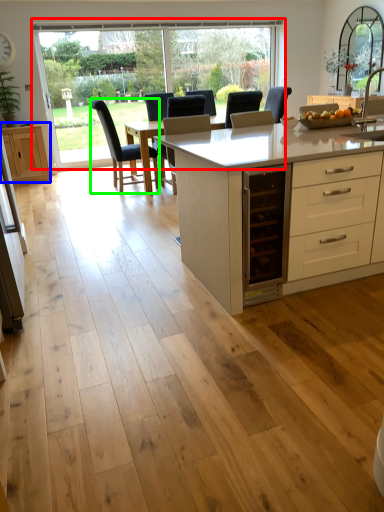
Question: Considering the real-world distances, which object is farthest from window (highlighted by a red box)? cabinetry (highlighted by a blue box) or chair (highlighted by a green box)?

Choices:
 (A) cabinetry
 (B) chair

Answer: (B)